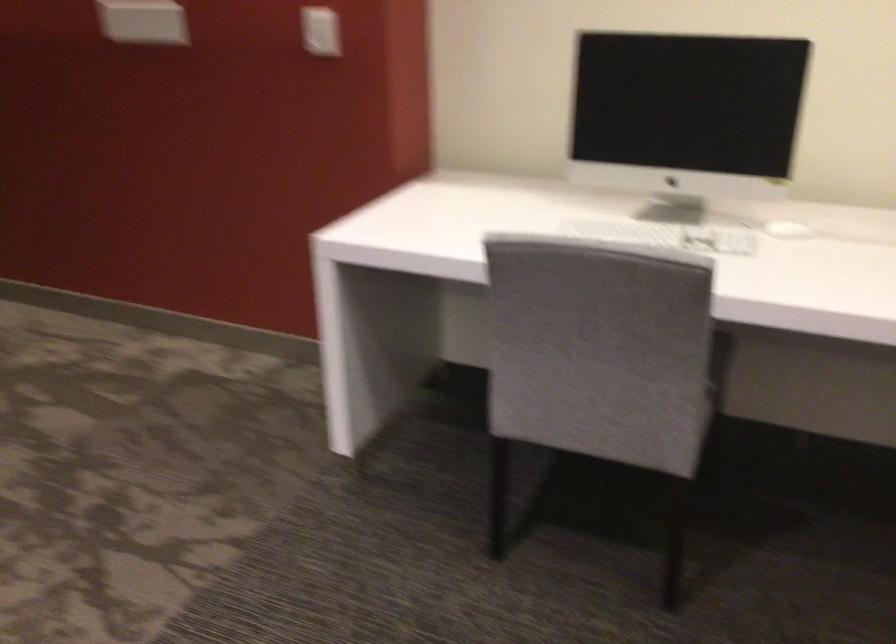
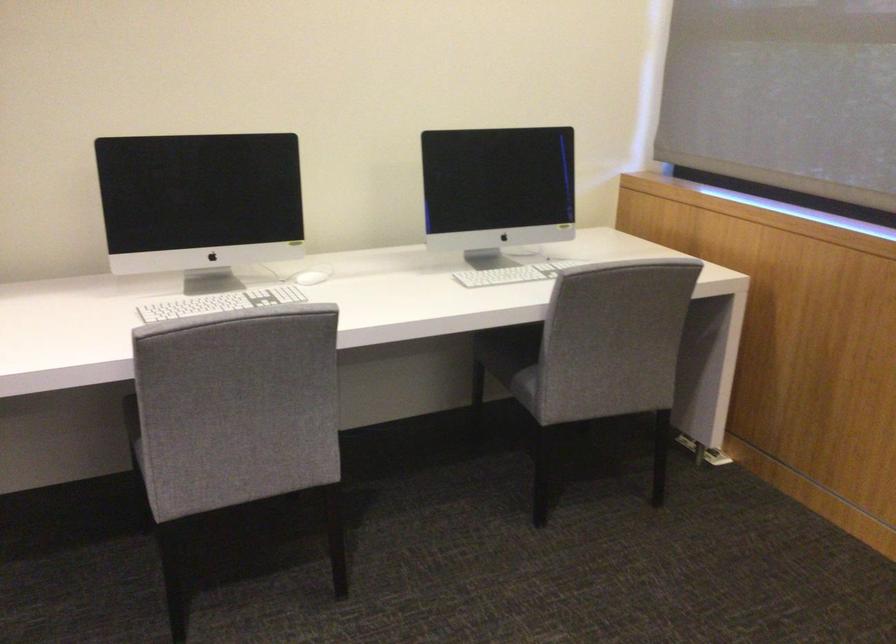
Where in the second image is the point corresponding to point 657,232 from the first image?

(220, 303)